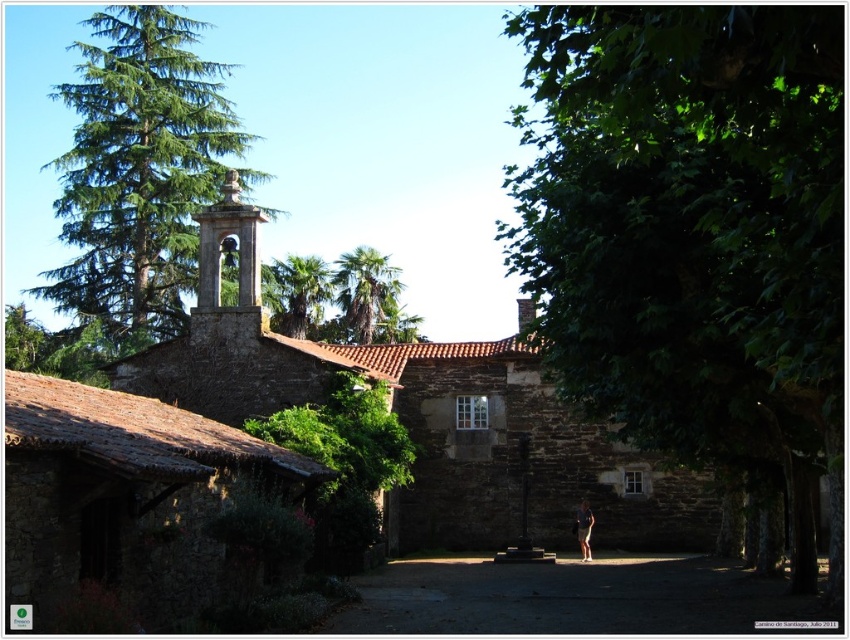
Is green coniferous tree at upper left to the right of brown leather shorts at center from the viewer's perspective?

No, green coniferous tree at upper left is not to the right of brown leather shorts at center.

At what (x,y) coordinates should I click in order to perform the action: click on green coniferous tree at upper left. Please return your answer as a coordinate pair (x, y). Looking at the image, I should click on (129, 188).

Find the location of `green coniferous tree at upper left`. green coniferous tree at upper left is located at coordinates (x=129, y=188).

Can you confirm if green leafy palm tree at upper center is positioned above green leafy palm at center?

Indeed, green leafy palm tree at upper center is positioned over green leafy palm at center.

Describe the element at coordinates (366, 289) in the screenshot. Image resolution: width=850 pixels, height=640 pixels. I see `green leafy palm tree at upper center` at that location.

Locate an element on the screen. green leafy palm tree at upper center is located at coordinates (366, 289).

Between green coniferous tree at upper left and green leafy palm at center, which one appears on the right side from the viewer's perspective?

Positioned to the right is green leafy palm at center.

Between green coniferous tree at upper left and green leafy palm at center, which one has less height?

Answer: With less height is green leafy palm at center.

Where is `green coniferous tree at upper left`? The image size is (850, 640). green coniferous tree at upper left is located at coordinates (129, 188).